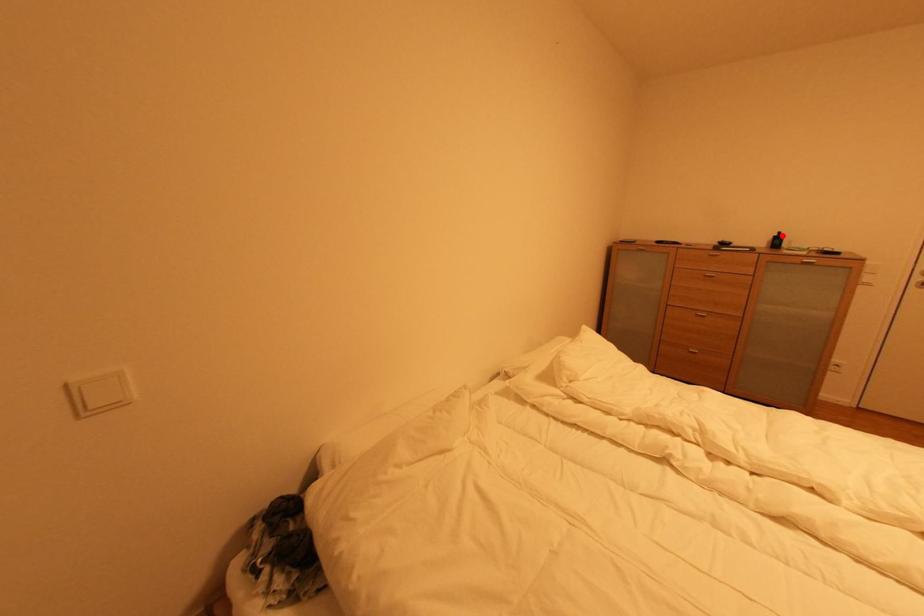
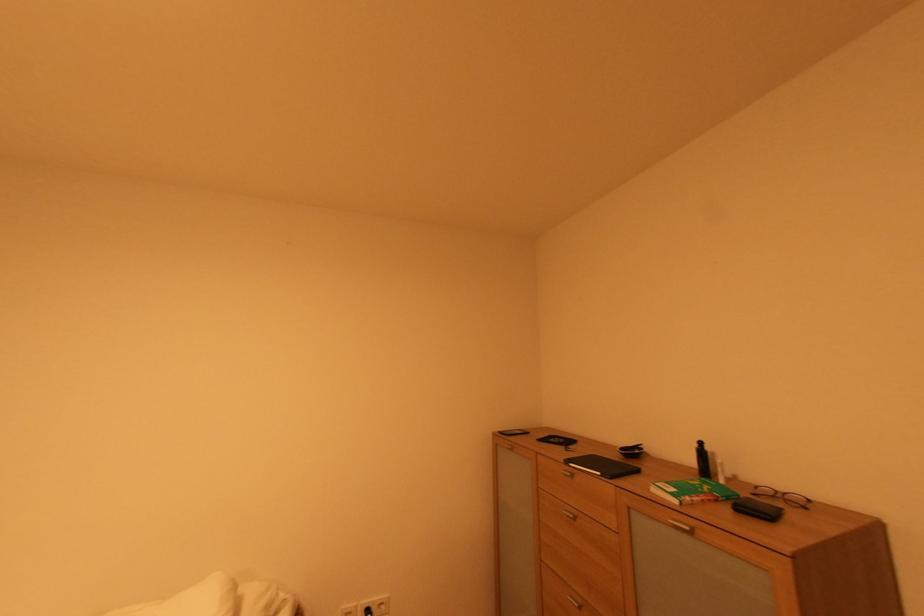
In the second image, find the point that corresponds to the highlighted location in the first image.

(701, 447)